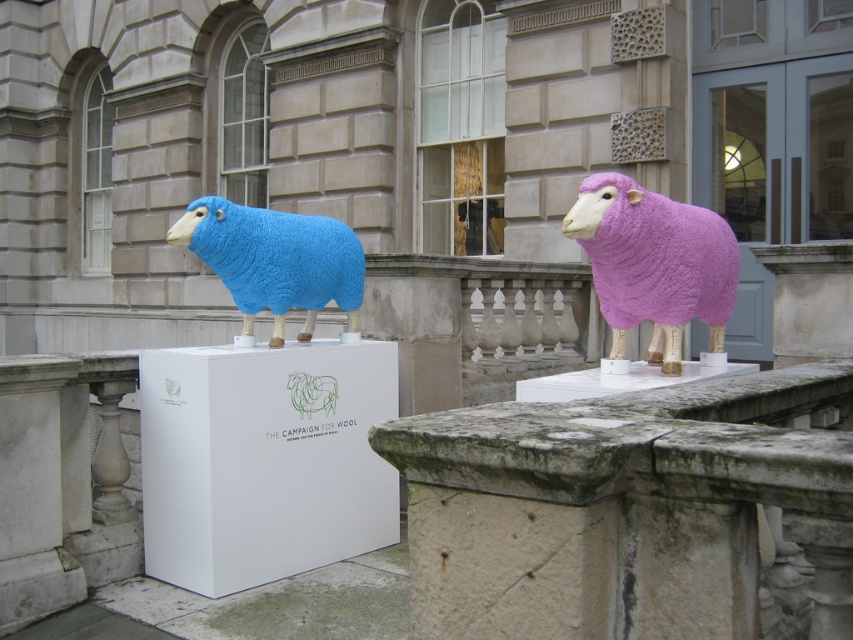
Question: Is pink woolen sheep at center to the left of matte blue woolen sheep at left from the viewer's perspective?

Choices:
 (A) no
 (B) yes

Answer: (A)

Question: Which point appears farthest from the camera in this image?

Choices:
 (A) (695, 240)
 (B) (216, 252)

Answer: (B)

Question: Among these objects, which one is nearest to the camera?

Choices:
 (A) pink woolen sheep at center
 (B) matte blue woolen sheep at left

Answer: (A)

Question: Can you confirm if pink woolen sheep at center is positioned to the right of matte blue woolen sheep at left?

Choices:
 (A) yes
 (B) no

Answer: (A)

Question: Considering the relative positions of pink woolen sheep at center and matte blue woolen sheep at left in the image provided, where is pink woolen sheep at center located with respect to matte blue woolen sheep at left?

Choices:
 (A) right
 (B) left

Answer: (A)